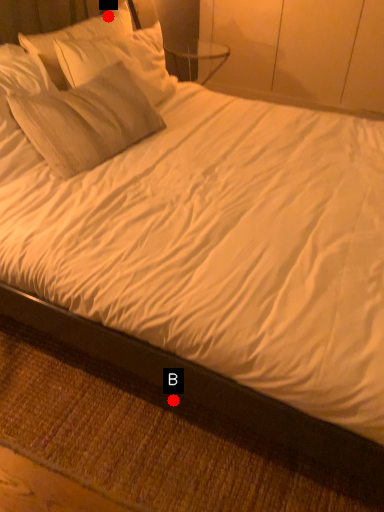
Question: Two points are circled on the image, labeled by A and B beside each circle. Among these points, which one is farthest from the camera?

Choices:
 (A) A is further
 (B) B is further

Answer: (A)